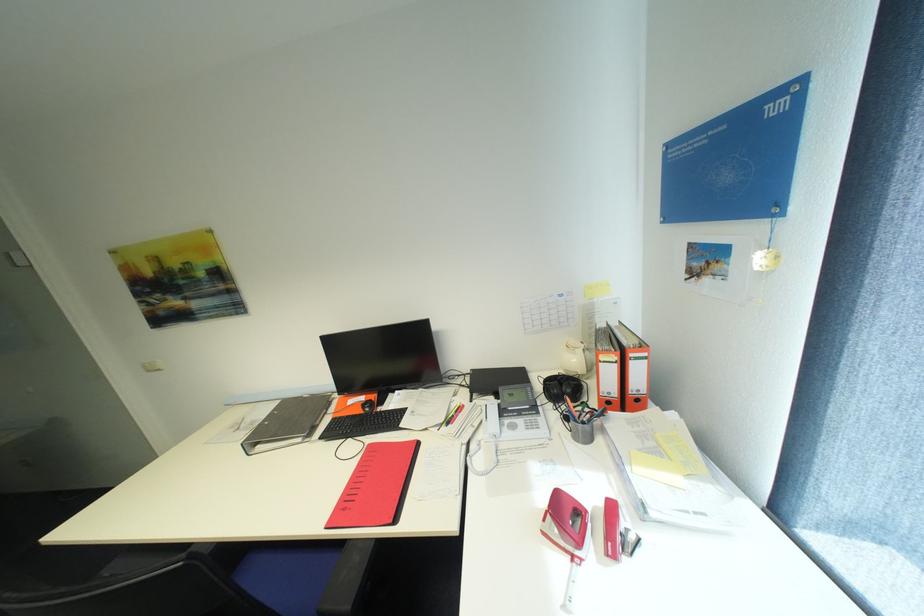
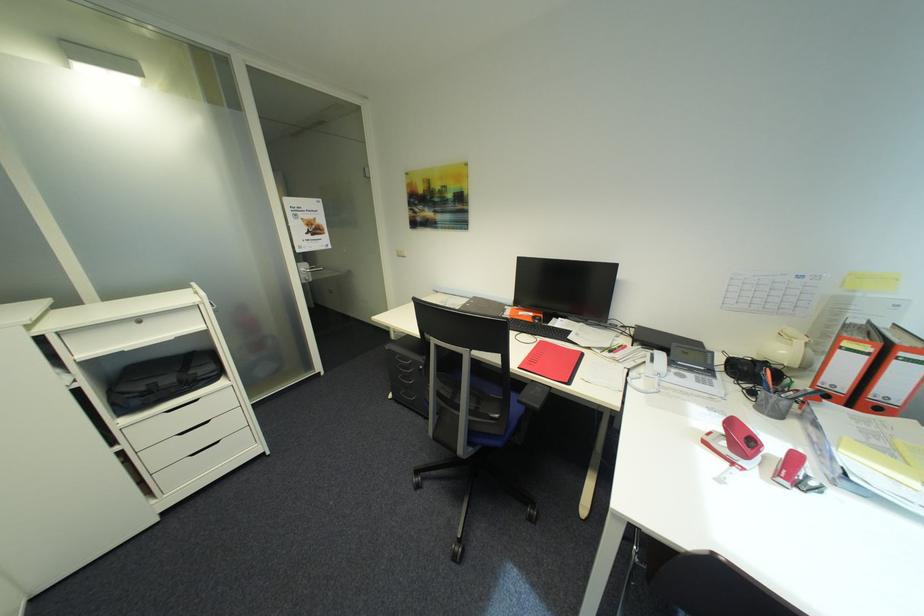
Locate, in the second image, the point that corresponds to point 623,367 in the first image.

(872, 359)